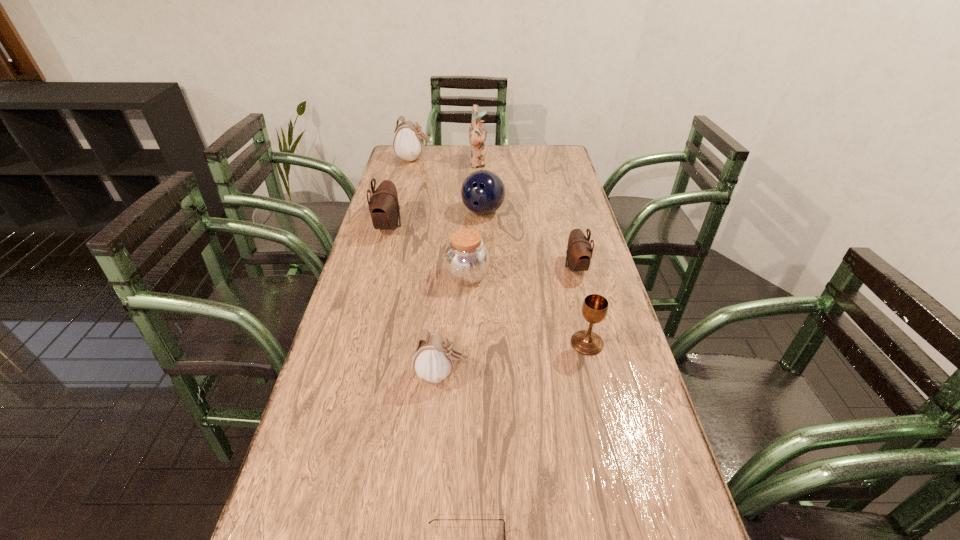
The image size is (960, 540). I want to click on the third pouch from left to right, so click(434, 356).

This screenshot has height=540, width=960. Find the location of `the rightmost pouch`. the rightmost pouch is located at coordinates (579, 251).

Locate an element on the screen. The image size is (960, 540). the nearer brown pouch is located at coordinates (579, 251).

Identify the location of vacant space located 0.340m on the front-facing side of the figurine. (567, 164).

What are the coordinates of `free region located on the front-facing side of the bigger white pouch` in the screenshot? It's located at (445, 159).

Find the location of a particular element. free point located 0.280m with the flap open on the farther brown pouch is located at coordinates (484, 226).

Locate an element on the screen. free space located on the surface of the bowling ball near the finger holes is located at coordinates (483, 241).

You are a GUI agent. You are given a task and a screenshot of the screen. Output one action in this format:
    pyautogui.click(x=<x>, y=<y>)
    Task: Click on the vacant region located on the back of the brown jar
    The height and width of the screenshot is (540, 960).
    Given the screenshot: What is the action you would take?
    pyautogui.click(x=469, y=210)

Where is `vacant space situated 0.110m on the left of the chalice`? Image resolution: width=960 pixels, height=540 pixels. vacant space situated 0.110m on the left of the chalice is located at coordinates (527, 343).

This screenshot has height=540, width=960. Find the location of `free space located on the front-facing side of the nearest pouch`. free space located on the front-facing side of the nearest pouch is located at coordinates (517, 374).